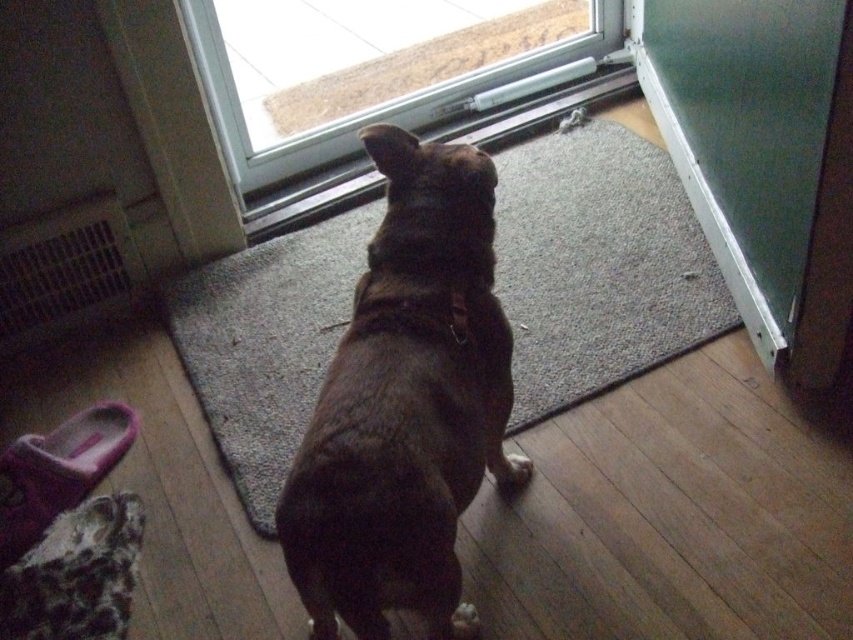
Question: Does transparent glass door at upper center appear over green glass screen door at upper right?

Choices:
 (A) no
 (B) yes

Answer: (B)

Question: Which object is closer to the camera taking this photo?

Choices:
 (A) green glass screen door at upper right
 (B) brown fur dog at center
 (C) transparent glass door at upper center

Answer: (B)

Question: Can you confirm if brown fur dog at center is positioned to the left of green glass screen door at upper right?

Choices:
 (A) yes
 (B) no

Answer: (A)

Question: Among these points, which one is nearest to the camera?

Choices:
 (A) (368, 1)
 (B) (718, 240)

Answer: (B)

Question: Does brown fur dog at center lie behind transparent glass door at upper center?

Choices:
 (A) yes
 (B) no

Answer: (B)

Question: Among these points, which one is farthest from the camera?

Choices:
 (A) (747, 20)
 (B) (527, 109)
 (C) (451, 186)

Answer: (B)